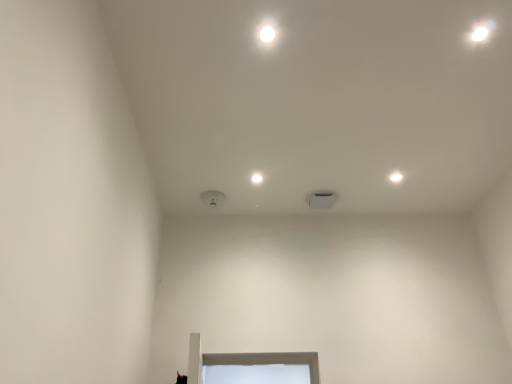
What do you see at coordinates (396, 177) in the screenshot?
I see `white matte light fixture at upper right, the 2th dot positioned from the left` at bounding box center [396, 177].

Identify the location of white matte light fixture at upper right, the 2th dot positioned from the left. (396, 177).

Describe the element at coordinates (257, 178) in the screenshot. The image size is (512, 384). I see `white matte square at center, the 2th dot in the right-to-left sequence` at that location.

This screenshot has width=512, height=384. Find the location of `white matte square at center, the 2th dot in the right-to-left sequence`. white matte square at center, the 2th dot in the right-to-left sequence is located at coordinates (257, 178).

Find the location of a particular element. The width and height of the screenshot is (512, 384). white matte light fixture at upper right, the 2th dot positioned from the left is located at coordinates (396, 177).

Between white matte light fixture at upper right, the 2th dot positioned from the left, and white matte square at center, the 2th dot in the right-to-left sequence, which one appears on the left side from the viewer's perspective?

From the viewer's perspective, white matte square at center, the 2th dot in the right-to-left sequence, appears more on the left side.

Is the position of white matte light fixture at upper right, the 2th dot positioned from the left, more distant than that of white matte square at center, the 1th dot from the left?

Yes, it is behind white matte square at center, the 1th dot from the left.

Is point (395, 179) closer to viewer compared to point (261, 181)?

No, (395, 179) is further to viewer.

From the image's perspective, which is above, white matte light fixture at upper right, the 2th dot positioned from the left, or white matte square at center, the 1th dot from the left?

white matte light fixture at upper right, the 2th dot positioned from the left, appears higher in the image.

From a real-world perspective, is white matte light fixture at upper right, the 2th dot positioned from the left, positioned above or below white matte square at center, the 2th dot in the right-to-left sequence?

From a real-world perspective, white matte light fixture at upper right, the 2th dot positioned from the left, is physically below white matte square at center, the 2th dot in the right-to-left sequence.

Which object is wider, white matte light fixture at upper right, the 1th dot viewed from the right, or white matte square at center, the 1th dot from the left?

white matte square at center, the 1th dot from the left, is wider.

Between white matte light fixture at upper right, the 2th dot positioned from the left, and white matte square at center, the 2th dot in the right-to-left sequence, which one has more height?

Standing taller between the two is white matte square at center, the 2th dot in the right-to-left sequence.

Based on their sizes in the image, would you say white matte light fixture at upper right, the 2th dot positioned from the left, is bigger or smaller than white matte square at center, the 2th dot in the right-to-left sequence?

In the image, white matte light fixture at upper right, the 2th dot positioned from the left, appears to be smaller than white matte square at center, the 2th dot in the right-to-left sequence.

Is white matte light fixture at upper right, the 2th dot positioned from the left, inside the boundaries of white matte square at center, the 1th dot from the left, or outside?

white matte light fixture at upper right, the 2th dot positioned from the left, lies outside white matte square at center, the 1th dot from the left.

Is white matte light fixture at upper right, the 1th dot viewed from the right, far from white matte square at center, the 1th dot from the left?

No, white matte light fixture at upper right, the 1th dot viewed from the right, is not far away from white matte square at center, the 1th dot from the left.

Is white matte light fixture at upper right, the 1th dot viewed from the right, turned away from white matte square at center, the 2th dot in the right-to-left sequence?

No, white matte light fixture at upper right, the 1th dot viewed from the right,'s orientation is not away from white matte square at center, the 2th dot in the right-to-left sequence.

Consider the image. Can you tell me how much white matte light fixture at upper right, the 2th dot positioned from the left, and white matte square at center, the 2th dot in the right-to-left sequence, differ in facing direction?

90 degrees separate the facing orientations of white matte light fixture at upper right, the 2th dot positioned from the left, and white matte square at center, the 2th dot in the right-to-left sequence.

Where is `dot on the right of white matte square at center, the 2th dot in the right-to-left sequence`? This screenshot has width=512, height=384. dot on the right of white matte square at center, the 2th dot in the right-to-left sequence is located at coordinates (396, 177).

Which is more to the left, white matte square at center, the 1th dot from the left, or white matte light fixture at upper right, the 1th dot viewed from the right?

Positioned to the left is white matte square at center, the 1th dot from the left.

Is white matte square at center, the 2th dot in the right-to-left sequence, behind white matte light fixture at upper right, the 2th dot positioned from the left?

No.

Is point (255, 179) farther from camera compared to point (391, 181)?

No, it is in front of (391, 181).

From the image's perspective, is white matte square at center, the 2th dot in the right-to-left sequence, above or below white matte light fixture at upper right, the 2th dot positioned from the left?

white matte square at center, the 2th dot in the right-to-left sequence, is below white matte light fixture at upper right, the 2th dot positioned from the left.

From a real-world perspective, is white matte square at center, the 2th dot in the right-to-left sequence, physically below white matte light fixture at upper right, the 1th dot viewed from the right?

No, from a real-world perspective, white matte square at center, the 2th dot in the right-to-left sequence, is not below white matte light fixture at upper right, the 1th dot viewed from the right.

Between white matte square at center, the 2th dot in the right-to-left sequence, and white matte light fixture at upper right, the 2th dot positioned from the left, which one has smaller width?

With smaller width is white matte light fixture at upper right, the 2th dot positioned from the left.

Looking at this image, considering the sizes of white matte square at center, the 1th dot from the left, and white matte light fixture at upper right, the 2th dot positioned from the left, in the image, is white matte square at center, the 1th dot from the left, taller or shorter than white matte light fixture at upper right, the 2th dot positioned from the left,?

In the image, white matte square at center, the 1th dot from the left, appears to be taller than white matte light fixture at upper right, the 2th dot positioned from the left.

Based on their sizes in the image, would you say white matte square at center, the 2th dot in the right-to-left sequence, is bigger or smaller than white matte light fixture at upper right, the 1th dot viewed from the right?

Considering their sizes, white matte square at center, the 2th dot in the right-to-left sequence, takes up more space than white matte light fixture at upper right, the 1th dot viewed from the right.

Is white matte light fixture at upper right, the 2th dot positioned from the left, surrounded by white matte square at center, the 2th dot in the right-to-left sequence?

No, white matte light fixture at upper right, the 2th dot positioned from the left, is located outside of white matte square at center, the 2th dot in the right-to-left sequence.

Is white matte square at center, the 2th dot in the right-to-left sequence, not near white matte light fixture at upper right, the 1th dot viewed from the right?

They are positioned close to each other.

Could you tell me if white matte square at center, the 1th dot from the left, is turned towards white matte light fixture at upper right, the 1th dot viewed from the right?

No, white matte square at center, the 1th dot from the left, is not facing towards white matte light fixture at upper right, the 1th dot viewed from the right.

Measure the distance between white matte square at center, the 1th dot from the left, and white matte light fixture at upper right, the 1th dot viewed from the right.

The distance of white matte square at center, the 1th dot from the left, from white matte light fixture at upper right, the 1th dot viewed from the right, is 77.86 centimeters.

Find the location of a particular element. The width and height of the screenshot is (512, 384). dot on the left side of white matte light fixture at upper right, the 1th dot viewed from the right is located at coordinates (257, 178).

Identify the location of dot that is under the white matte square at center, the 1th dot from the left (from a real-world perspective). (396, 177).

The image size is (512, 384). I want to click on dot lying on the left of white matte light fixture at upper right, the 1th dot viewed from the right, so click(257, 178).